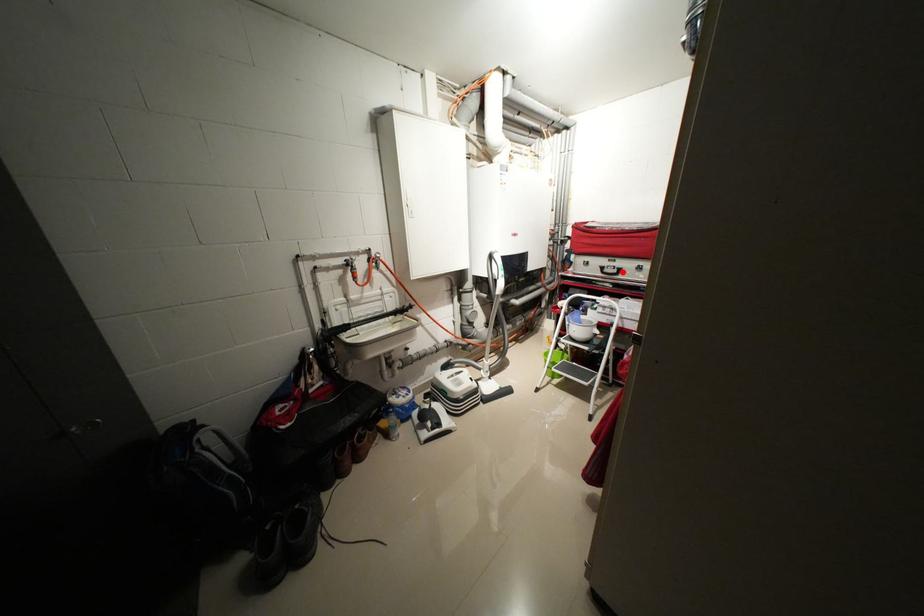
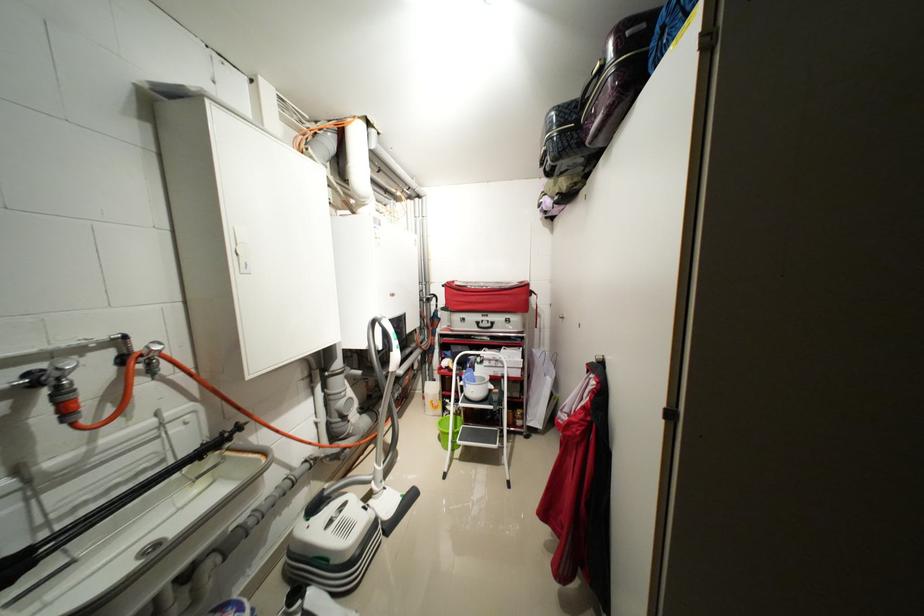
Locate, in the second image, the point that corresponds to the highlighted location in the first image.

(496, 326)